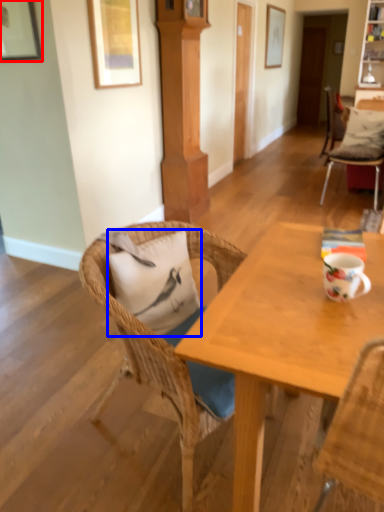
Question: Which of the following is the farthest to the observer, picture frame (highlighted by a red box) or pillow (highlighted by a blue box)?

Choices:
 (A) picture frame
 (B) pillow

Answer: (A)